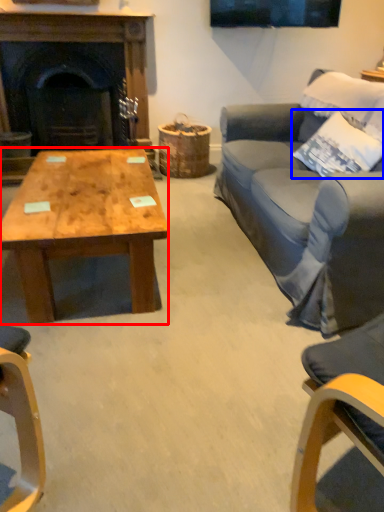
Question: Which object is further to the camera taking this photo, coffee table (highlighted by a red box) or pillow (highlighted by a blue box)?

Choices:
 (A) coffee table
 (B) pillow

Answer: (B)